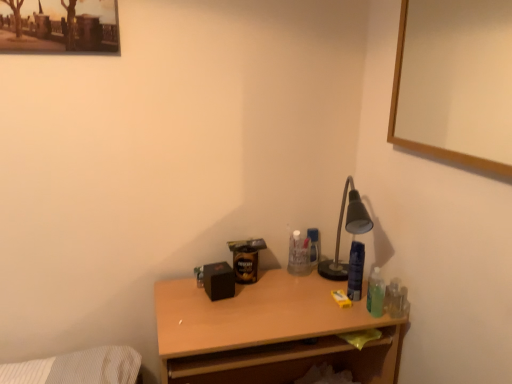
Question: Does wooden desk at center have a lesser height compared to wooden picture frame at upper right?

Choices:
 (A) yes
 (B) no

Answer: (B)

Question: Can you confirm if wooden desk at center is positioned to the left of wooden picture frame at upper right?

Choices:
 (A) no
 (B) yes

Answer: (B)

Question: Is wooden desk at center placed right next to wooden picture frame at upper right?

Choices:
 (A) no
 (B) yes

Answer: (A)

Question: From a real-world perspective, is wooden desk at center located higher than wooden picture frame at upper right?

Choices:
 (A) no
 (B) yes

Answer: (A)

Question: From the image's perspective, is wooden desk at center above wooden picture frame at upper right?

Choices:
 (A) no
 (B) yes

Answer: (A)

Question: Can you confirm if wooden desk at center is positioned to the right of wooden picture frame at upper right?

Choices:
 (A) yes
 (B) no

Answer: (B)

Question: From the image's perspective, is wooden picture frame at upper right located beneath wooden desk at center?

Choices:
 (A) yes
 (B) no

Answer: (B)

Question: Does wooden picture frame at upper right have a smaller size compared to wooden desk at center?

Choices:
 (A) yes
 (B) no

Answer: (A)

Question: From a real-world perspective, is wooden picture frame at upper right positioned under wooden desk at center based on gravity?

Choices:
 (A) no
 (B) yes

Answer: (A)

Question: Does wooden picture frame at upper right have a lesser width compared to wooden desk at center?

Choices:
 (A) yes
 (B) no

Answer: (A)

Question: Is wooden picture frame at upper right positioned beyond the bounds of wooden desk at center?

Choices:
 (A) no
 (B) yes

Answer: (B)

Question: Could you tell me if wooden picture frame at upper right is facing wooden desk at center?

Choices:
 (A) yes
 (B) no

Answer: (B)

Question: In the image, is wooden desk at center positioned in front of or behind wooden picture frame at upper right?

Choices:
 (A) front
 (B) behind

Answer: (B)